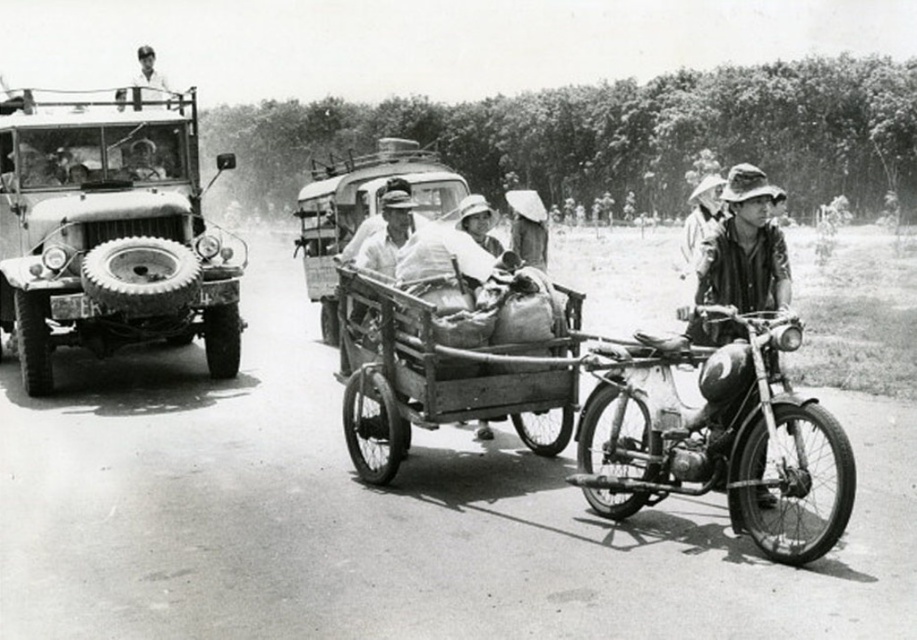
You are a pedestrian standing on the side of the road in this scene. You notice a wooden cart at center and a matte black motorcycle at right. Which of these two objects is closer to you?

The wooden cart at center is closer to you because the matte black motorcycle at right is behind it.